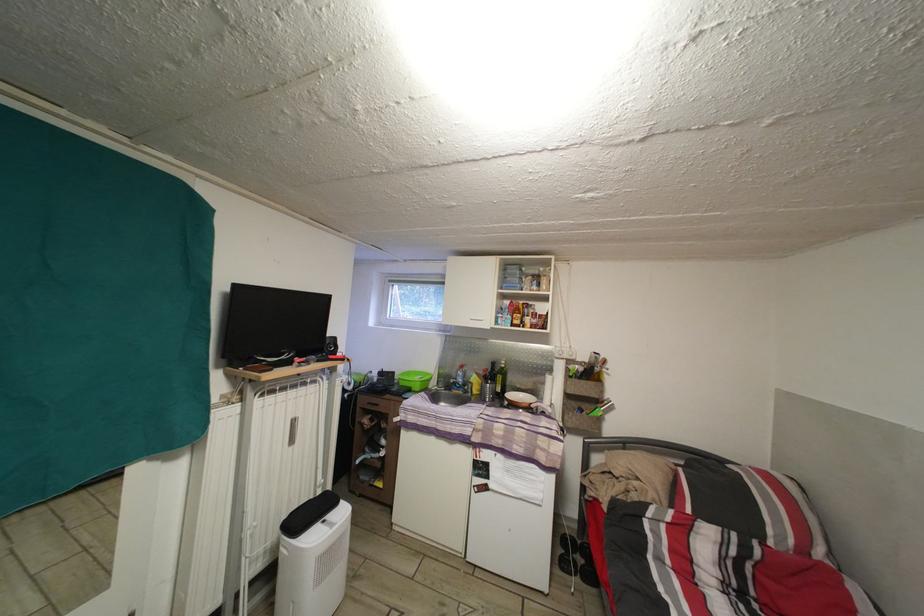
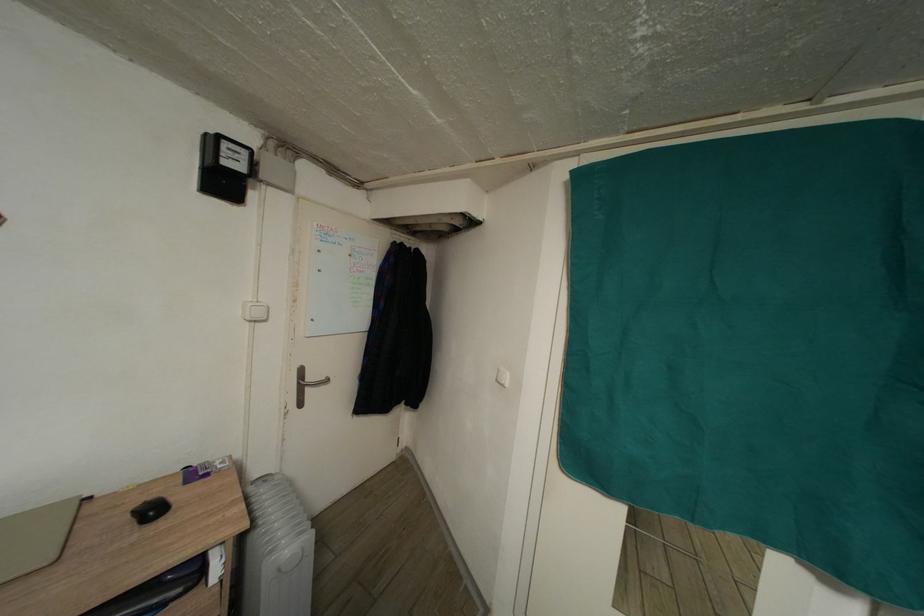
Question: The first image is from the beginning of the video and the second image is from the end. How did the camera likely rotate when shooting the video?

Choices:
 (A) Left
 (B) Right
 (C) Up
 (D) Down

Answer: (A)